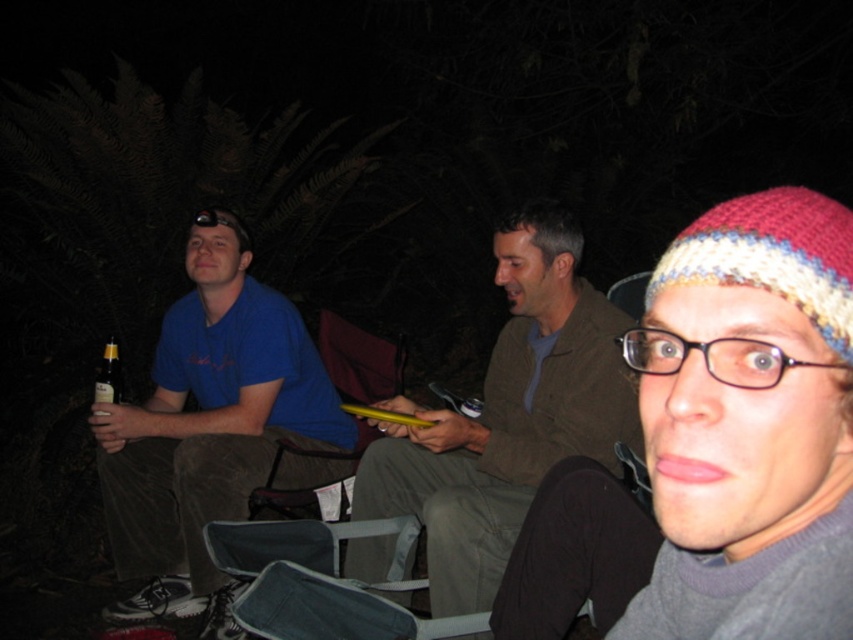
You are standing in the scene and want to place a small flag exactly halfway between point (273, 404) and point (548, 304). Will the flag be closer to the camera or further away from it compared to the two points?

The flag placed halfway between point (273, 404) and point (548, 304) will be closer to the camera than point (548, 304) but further away than point (273, 404). Since the flag is halfway, its distance from the camera would be an average of the two points. Since point (273, 404) is closer to the camera than point (548, 304), the flag will be closer to the camera than the farther point but further than the closer one.

You are trying to decide which item to pack first for your trip. The knitted wool hat at upper right and the blue cotton shirt at left are both in your bag. Which item takes up less space?

The knitted wool hat at upper right takes up less space than the blue cotton shirt at left because it has a smaller size compared to the blue cotton shirt at left.